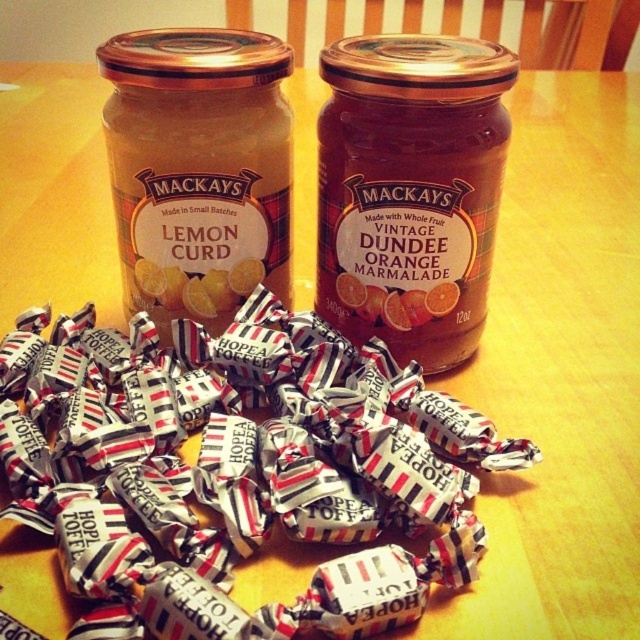
Is white striped paper wrapped toffee at center thinner than matte glass jar at center?

Incorrect, white striped paper wrapped toffee at center's width is not less than matte glass jar at center's.

Between point (310, 422) and point (410, 90), which one is positioned behind?

Point (310, 422)

What do you see at coordinates (237, 470) in the screenshot? I see `white striped paper wrapped toffee at center` at bounding box center [237, 470].

Find the location of `white striped paper wrapped toffee at center`. white striped paper wrapped toffee at center is located at coordinates (237, 470).

The width and height of the screenshot is (640, 640). Describe the element at coordinates (410, 189) in the screenshot. I see `matte glass jar at center` at that location.

The image size is (640, 640). I want to click on matte glass jar at center, so (410, 189).

This screenshot has width=640, height=640. I want to click on matte glass jar at center, so click(410, 189).

Does white striped paper wrapped toffee at center come behind matte glass jar at left?

No, white striped paper wrapped toffee at center is closer to the viewer.

Does white striped paper wrapped toffee at center have a greater width compared to matte glass jar at left?

Yes, white striped paper wrapped toffee at center is wider than matte glass jar at left.

You are a GUI agent. You are given a task and a screenshot of the screen. Output one action in this format:
    pyautogui.click(x=<x>, y=<y>)
    Task: Click on the white striped paper wrapped toffee at center
    
    Given the screenshot: What is the action you would take?
    pyautogui.click(x=237, y=470)

Locate an element on the screen. white striped paper wrapped toffee at center is located at coordinates (237, 470).